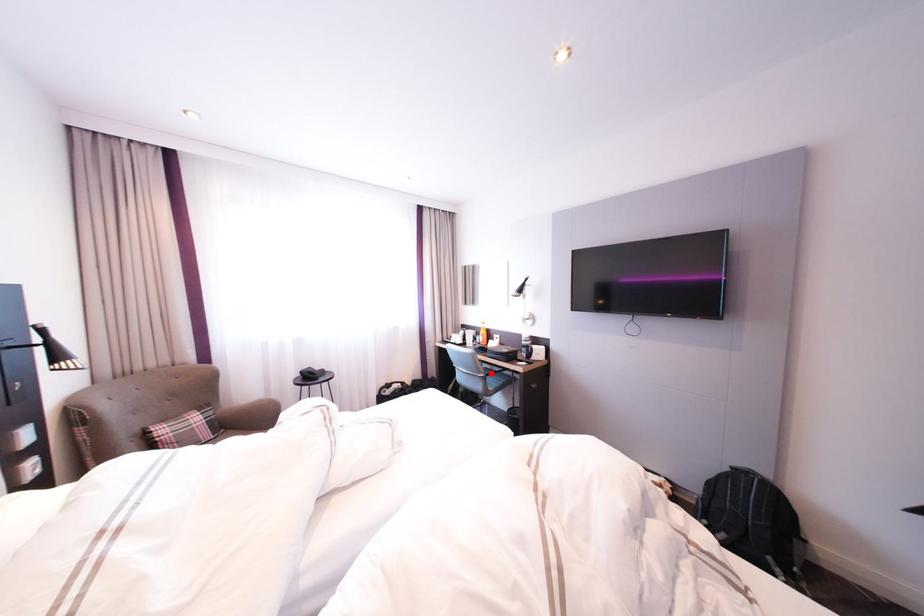
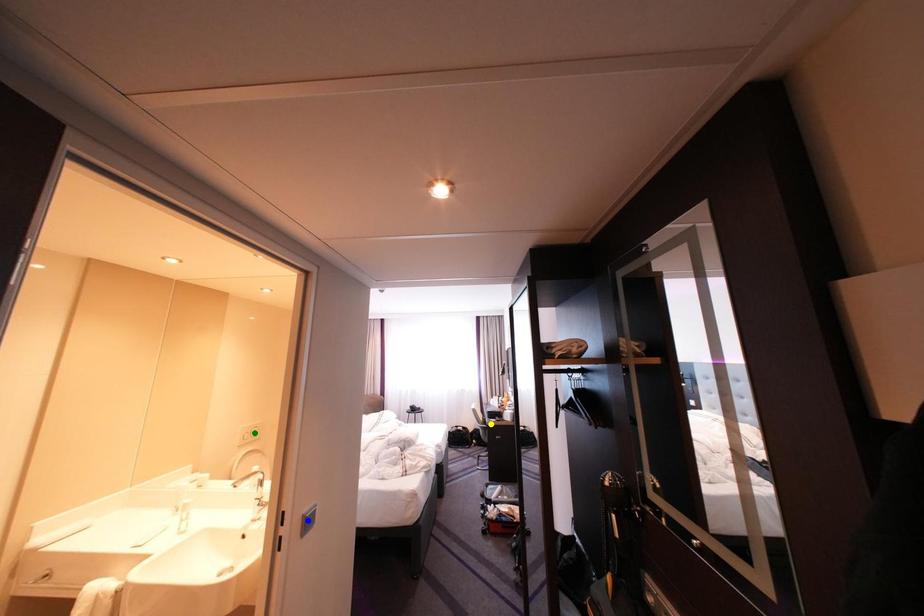
Question: I am providing you with two images of the same scene from different viewpoints. A red point is marked on the first image. You are given multiple points on the second image. Which mark in image 2 goes with the point in image 1?

Choices:
 (A) yellow point
 (B) green point
 (C) blue point

Answer: (A)